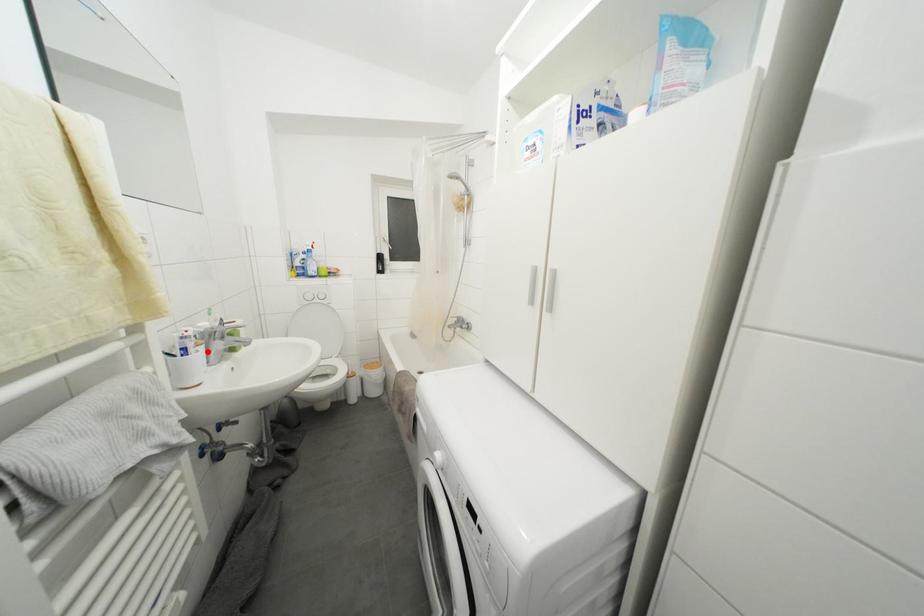
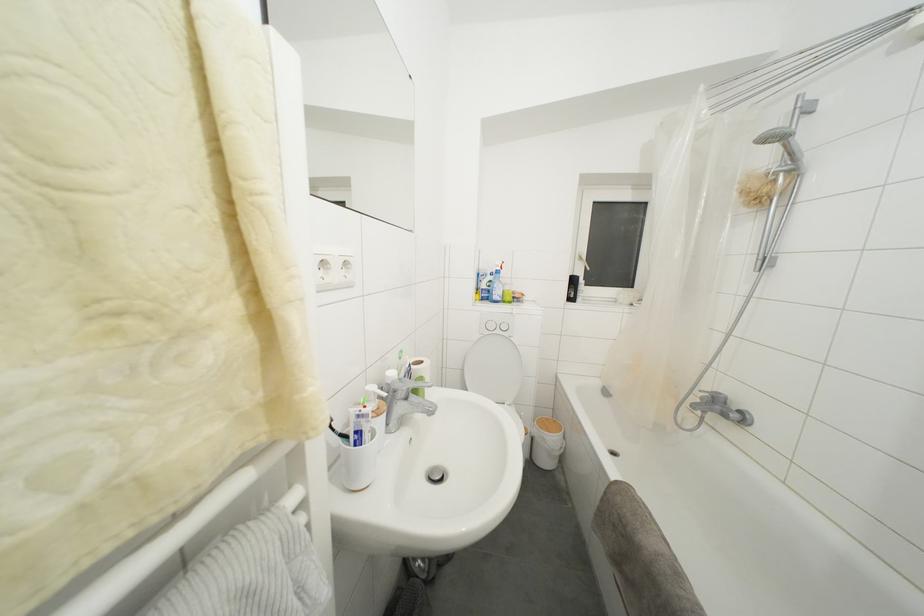
The point at the highlighted location is marked in the first image. Where is the corresponding point in the second image?

(388, 419)